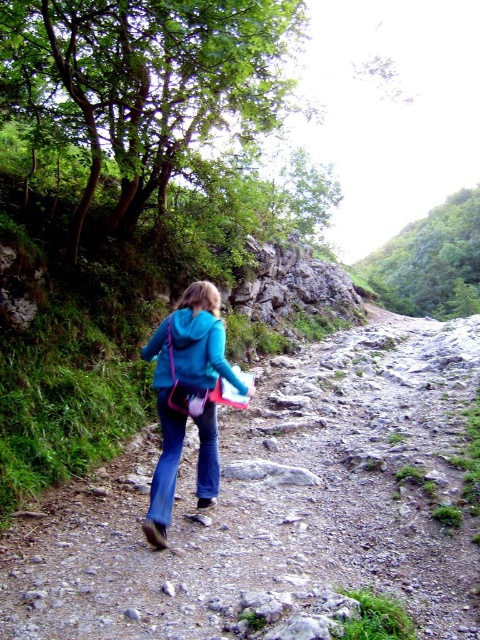
The image size is (480, 640). What do you see at coordinates (275, 508) in the screenshot? I see `dusty gravel path at center` at bounding box center [275, 508].

Who is more distant from viewer, (309, 349) or (217, 326)?

The point (309, 349) is more distant.

Where is `dusty gravel path at center`? dusty gravel path at center is located at coordinates (275, 508).

The image size is (480, 640). I want to click on dusty gravel path at center, so (x=275, y=508).

Which is in front, point (210, 292) or point (232, 381)?

Point (232, 381) is in front.

Is teal matte jacket at center closer to the viewer compared to matte blue jacket at center?

Yes, it is.

Is point (240, 384) positioned behind point (192, 344)?

Yes.

The height and width of the screenshot is (640, 480). In order to click on teal matte jacket at center in this screenshot , I will do `click(188, 397)`.

Find the location of a particular element. The height and width of the screenshot is (640, 480). dusty gravel path at center is located at coordinates (275, 508).

Which of these two, dusty gravel path at center or teal matte jacket at center, stands taller?

Standing taller between the two is teal matte jacket at center.

Between point (367, 550) and point (173, 465), which one is positioned behind?

The point (173, 465) is more distant.

Where is `dusty gravel path at center`? dusty gravel path at center is located at coordinates (275, 508).